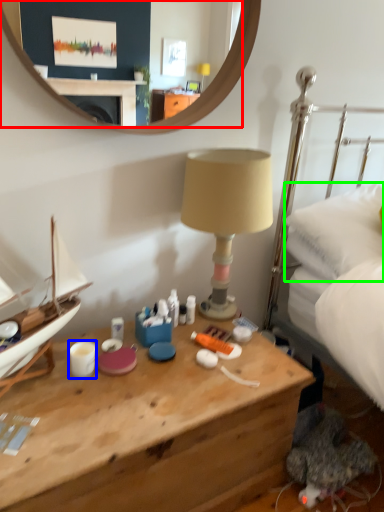
Question: Which is nearer to the mirror (highlighted by a red box)? coffee cup (highlighted by a blue box) or pillow (highlighted by a green box).

Choices:
 (A) coffee cup
 (B) pillow

Answer: (B)